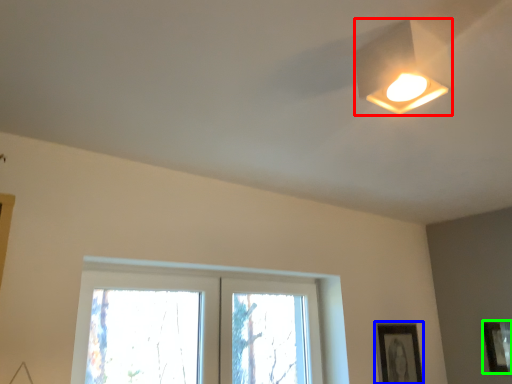
Question: Based on their relative distances, which object is nearer to lamp (highlighted by a red box)? Choose from picture frame (highlighted by a blue box) and picture frame (highlighted by a green box).

Choices:
 (A) picture frame
 (B) picture frame

Answer: (A)